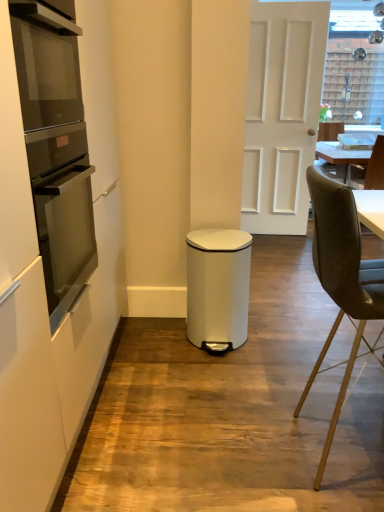
The image size is (384, 512). What are the coordinates of `vacant area on the back side of leather-like brown chair at right, which appears as the 1th chair when viewed from the left` in the screenshot? It's located at (x=296, y=385).